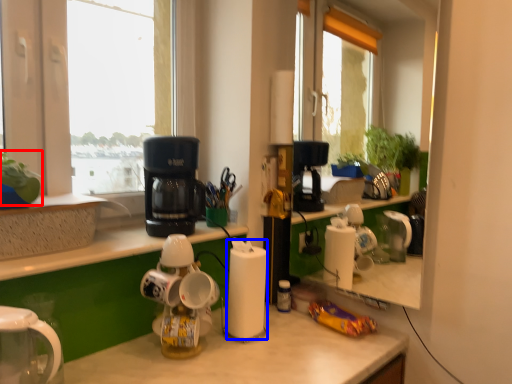
Question: Which point is further to the camera, plant (highlighted by a red box) or paper towel (highlighted by a blue box)?

Choices:
 (A) plant
 (B) paper towel

Answer: (B)